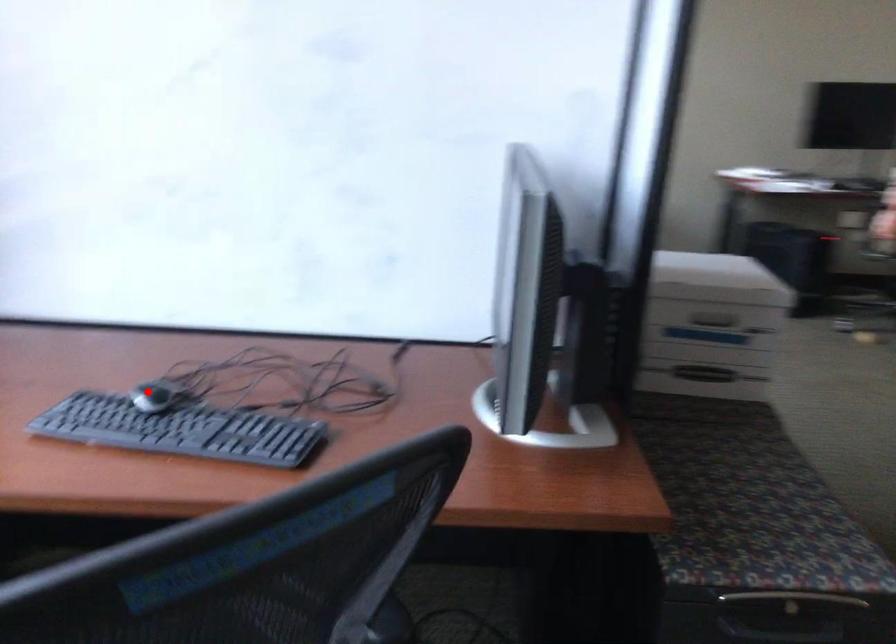
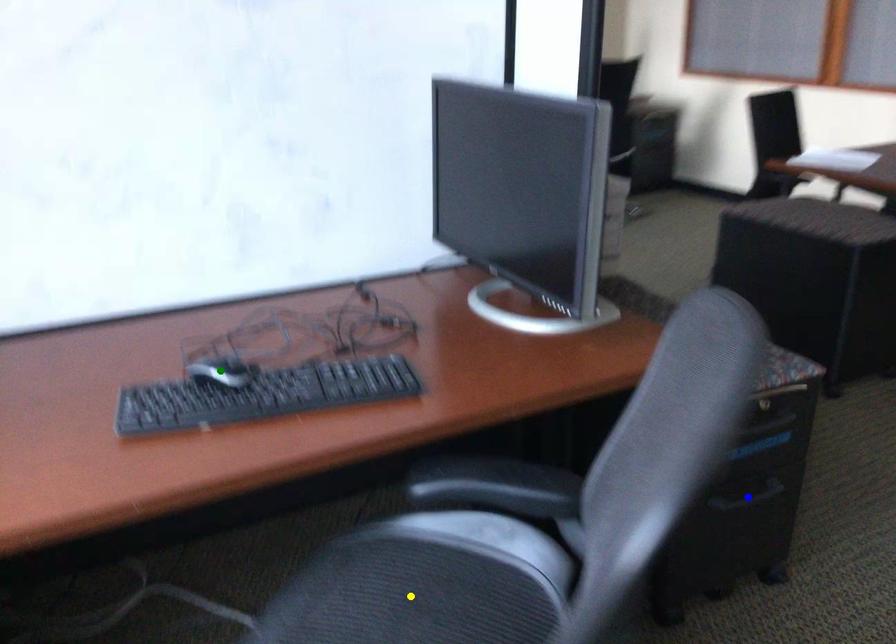
Question: I am providing you with two images of the same scene from different viewpoints. A red point is marked on the first image. You are given multiple points on the second image. Which spot in image 2 lines up with the point in image 1?

Choices:
 (A) yellow point
 (B) green point
 (C) blue point

Answer: (B)